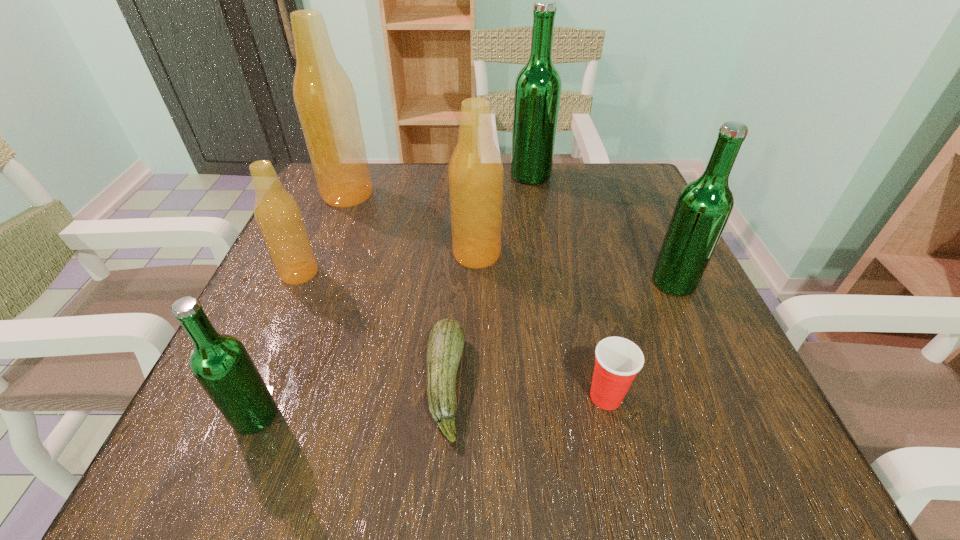
Identify the location of tan beer bottle that is the second closest one to the smallest green beer bottle. (476, 173).

Where is `free space that satisfies the following two spatial constraints: 1. on the front side of the second smallest tan beer bottle; 2. at the stem end of the zucchini`? The width and height of the screenshot is (960, 540). free space that satisfies the following two spatial constraints: 1. on the front side of the second smallest tan beer bottle; 2. at the stem end of the zucchini is located at coordinates (475, 384).

The image size is (960, 540). I want to click on free location that satisfies the following two spatial constraints: 1. on the front side of the rightmost green beer bottle; 2. at the stem end of the green zucchini, so click(721, 384).

The width and height of the screenshot is (960, 540). I want to click on free space that satisfies the following two spatial constraints: 1. on the front side of the Dixie cup; 2. on the left side of the smallest tan beer bottle, so click(245, 396).